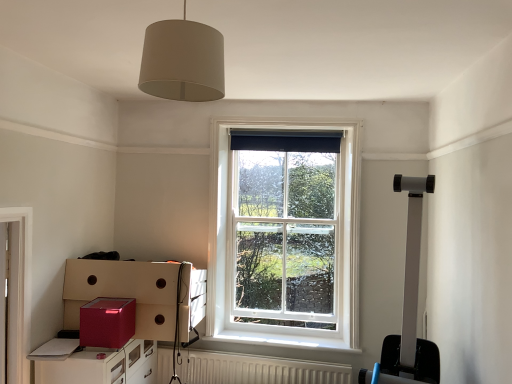
Question: Is matte white lampshade at upper center next to white wooden window at center and touching it?

Choices:
 (A) yes
 (B) no

Answer: (B)

Question: Can you confirm if matte white lampshade at upper center is positioned to the right of white wooden window at center?

Choices:
 (A) no
 (B) yes

Answer: (A)

Question: Considering the relative sizes of matte white lampshade at upper center and white wooden window at center in the image provided, is matte white lampshade at upper center taller than white wooden window at center?

Choices:
 (A) yes
 (B) no

Answer: (B)

Question: Considering the relative sizes of matte white lampshade at upper center and white wooden window at center in the image provided, is matte white lampshade at upper center wider than white wooden window at center?

Choices:
 (A) yes
 (B) no

Answer: (A)

Question: Would you consider matte white lampshade at upper center to be distant from white wooden window at center?

Choices:
 (A) yes
 (B) no

Answer: (A)

Question: Is matte white lampshade at upper center smaller than white wooden window at center?

Choices:
 (A) yes
 (B) no

Answer: (A)

Question: From a real-world perspective, is shiny red cardboard box at lower left, marked as the second cardboard box in a back-to-front arrangement, under white wooden window at center?

Choices:
 (A) yes
 (B) no

Answer: (A)

Question: Does shiny red cardboard box at lower left, marked as the second cardboard box in a back-to-front arrangement, have a smaller size compared to white wooden window at center?

Choices:
 (A) no
 (B) yes

Answer: (B)

Question: Is shiny red cardboard box at lower left, positioned as the first cardboard box in front-to-back order, bigger than white wooden window at center?

Choices:
 (A) no
 (B) yes

Answer: (A)

Question: Considering the relative sizes of shiny red cardboard box at lower left, positioned as the first cardboard box in front-to-back order, and white wooden window at center in the image provided, is shiny red cardboard box at lower left, positioned as the first cardboard box in front-to-back order, taller than white wooden window at center?

Choices:
 (A) no
 (B) yes

Answer: (A)

Question: Is white wooden window at center located within shiny red cardboard box at lower left, marked as the second cardboard box in a back-to-front arrangement?

Choices:
 (A) no
 (B) yes

Answer: (A)

Question: Does shiny red cardboard box at lower left, marked as the second cardboard box in a back-to-front arrangement, have a lesser height compared to white wooden window at center?

Choices:
 (A) no
 (B) yes

Answer: (B)

Question: From the image's perspective, does white textured radiator at lower center appear lower than black fabric curtain at upper center?

Choices:
 (A) no
 (B) yes

Answer: (B)